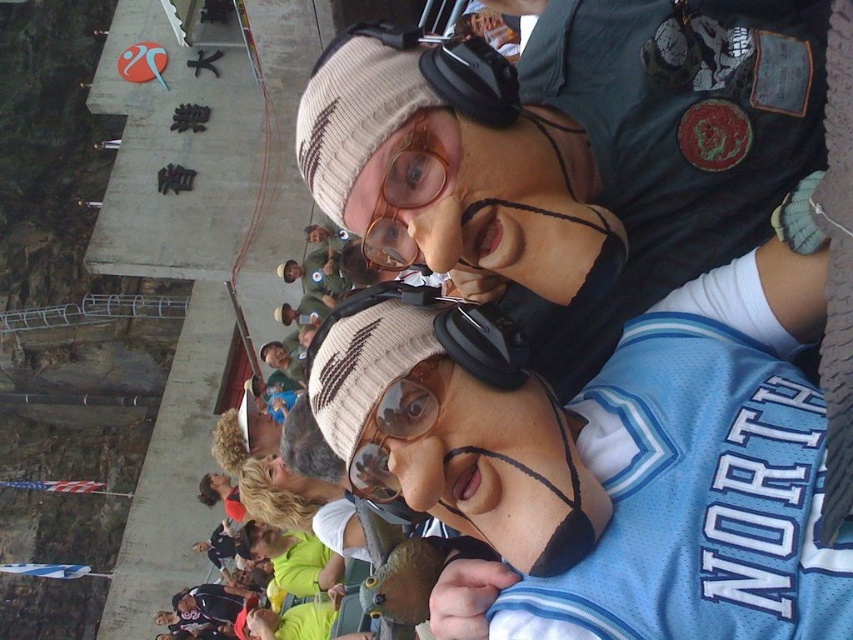
Question: Does knit cap at upper center come behind matte plastic goggles at center?

Choices:
 (A) no
 (B) yes

Answer: (B)

Question: Which object appears farthest from the camera in this image?

Choices:
 (A) knit cap at upper center
 (B) matte plastic goggles at center
 (C) clear plastic goggles at center

Answer: (C)

Question: Does clear plastic goggles at center have a smaller size compared to matte plastic goggles at center?

Choices:
 (A) yes
 (B) no

Answer: (B)

Question: Which of the following is the farthest from the observer?

Choices:
 (A) clear plastic goggles at center
 (B) knit cap at upper center

Answer: (A)

Question: Is knit cap at upper center to the left of matte plastic goggles at center from the viewer's perspective?

Choices:
 (A) no
 (B) yes

Answer: (A)

Question: Which object is positioned farthest from the matte plastic goggles at center?

Choices:
 (A) clear plastic goggles at center
 (B) knit cap at upper center

Answer: (B)